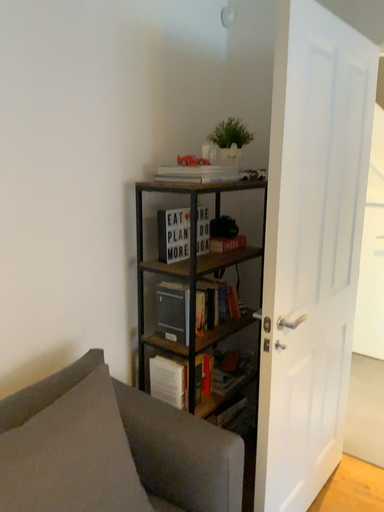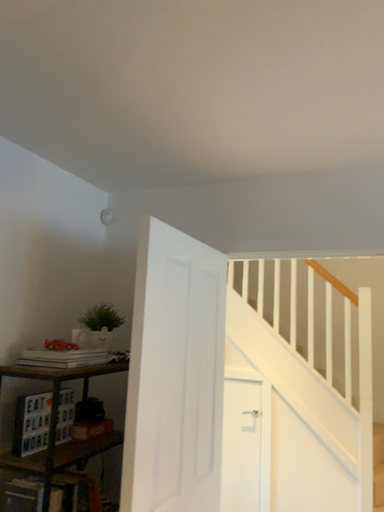
Question: Which way did the camera rotate in the video?

Choices:
 (A) rotated right
 (B) rotated left

Answer: (A)